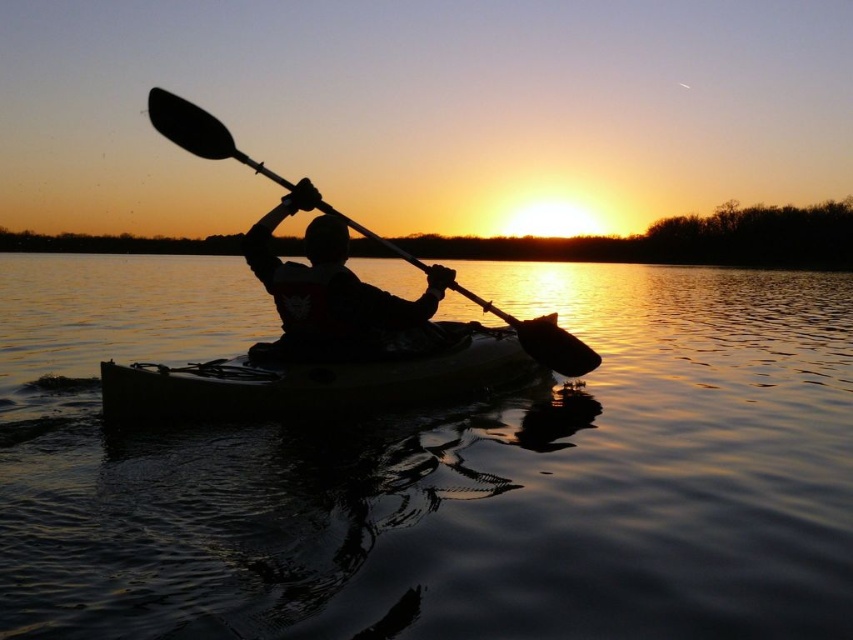
Consider the image. Can you confirm if yellow matte canoe at center is positioned below smooth black paddle at center?

Indeed, yellow matte canoe at center is positioned under smooth black paddle at center.

What are the coordinates of `yellow matte canoe at center` in the screenshot? It's located at (311, 380).

Locate an element on the screen. This screenshot has width=853, height=640. yellow matte canoe at center is located at coordinates (311, 380).

Can you confirm if transparent water at center is wider than smooth black paddle at center?

Indeed, transparent water at center has a greater width compared to smooth black paddle at center.

Who is more forward, [587,621] or [190,122]?

Positioned in front is point [587,621].

Describe the element at coordinates (438, 468) in the screenshot. I see `transparent water at center` at that location.

This screenshot has height=640, width=853. I want to click on transparent water at center, so click(438, 468).

Between point (318, 358) and point (389, 248), which one is positioned behind?

Point (389, 248)

Can you confirm if silhouette kayak at center is wider than smooth black paddle at center?

A: Correct, the width of silhouette kayak at center exceeds that of smooth black paddle at center.

Is point (427, 333) positioned behind point (369, 236)?

Yes, point (427, 333) is farther from viewer.

Where is `silhouette kayak at center`? This screenshot has height=640, width=853. silhouette kayak at center is located at coordinates (335, 296).